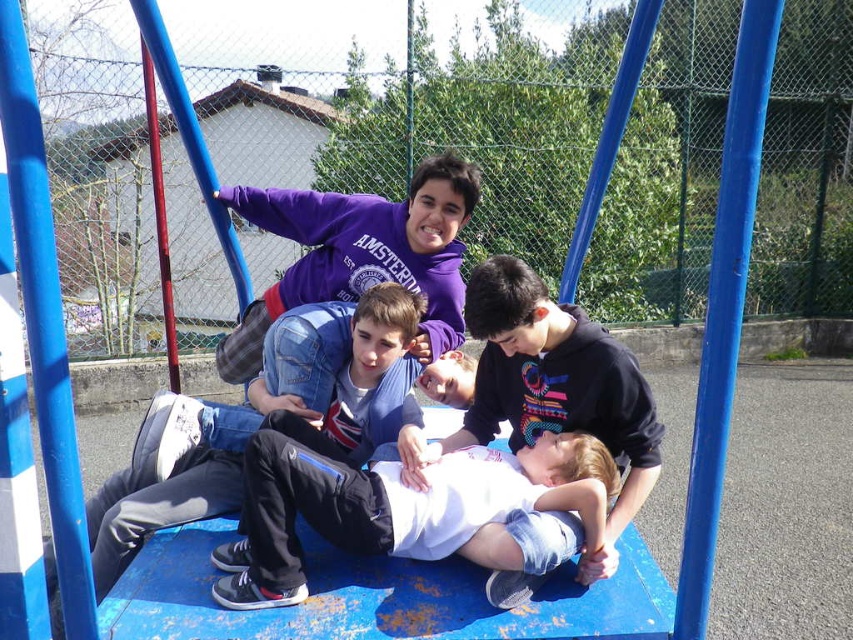
You are a photographer trying to capture a clear shot of both the white matte shirt at center and the denim jacket at center. Since you want both subjects to appear equally prominent in the photo, which adjustment should you make based on their sizes?

The white matte shirt at center is bigger than the denim jacket at center. To make them appear equally prominent, you should move the camera closer to the denim jacket at center so that it fills more of the frame, balancing its smaller size against the larger white matte shirt at center.